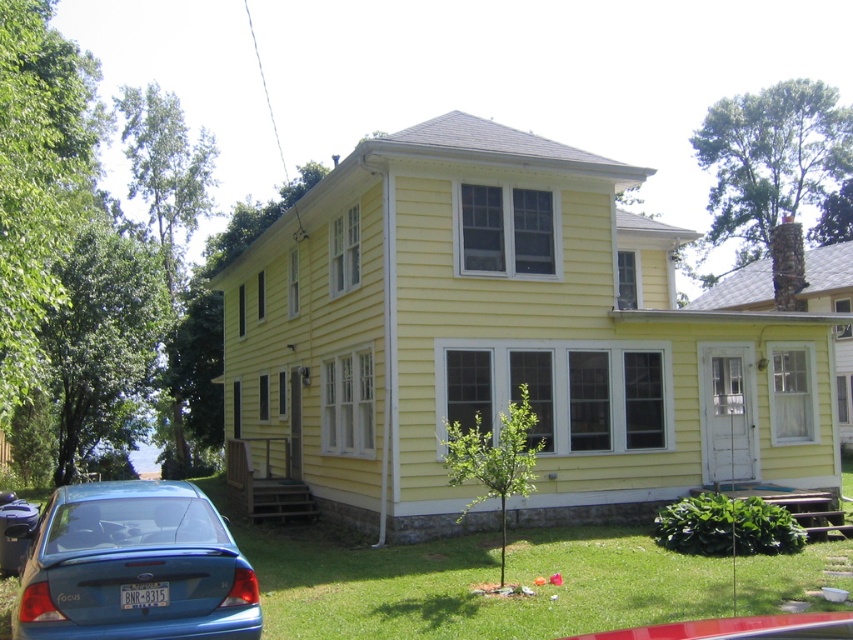
Who is taller, yellow siding at center or blue matte sedan at lower left?

Standing taller between the two is yellow siding at center.

Is yellow siding at center positioned at the back of blue matte sedan at lower left?

That is True.

Which is behind, point (306, 348) or point (120, 616)?

Point (306, 348)

I want to click on yellow siding at center, so click(503, 339).